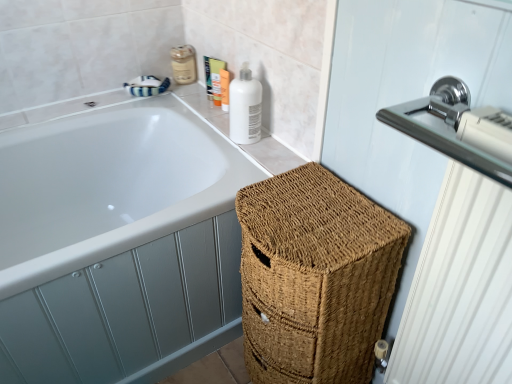
Locate an element on the screen. vacant space in between matte beige lotion at upper center, the 1th toiletry when ordered from left to right, and matte white lotion at upper right, the 1th toiletry from the right is located at coordinates (198, 87).